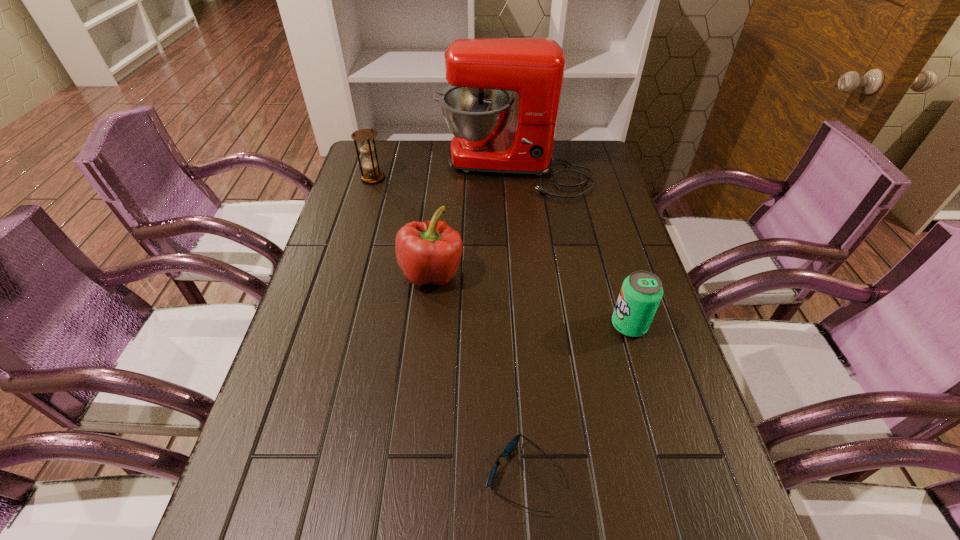
Identify the location of the tallest object. (482, 72).

Locate an element on the screen. bell pepper is located at coordinates (427, 252).

Find the location of a particular element. the leftmost object is located at coordinates (366, 146).

Where is `pop soda`? The width and height of the screenshot is (960, 540). pop soda is located at coordinates (640, 295).

Where is `the nearest object`? The image size is (960, 540). the nearest object is located at coordinates (513, 443).

Find the location of a particular element. sunglasses is located at coordinates (513, 443).

Locate an element on the screen. free region located 0.280m on the front-facing side of the tallest object is located at coordinates (522, 264).

This screenshot has height=540, width=960. I want to click on vacant area situated on the front of the bell pepper, so click(421, 363).

The height and width of the screenshot is (540, 960). Find the location of `vacant space located 0.110m on the back of the leftmost object`. vacant space located 0.110m on the back of the leftmost object is located at coordinates (380, 154).

Where is `free region located on the front-facing side of the pop soda`? The image size is (960, 540). free region located on the front-facing side of the pop soda is located at coordinates (478, 325).